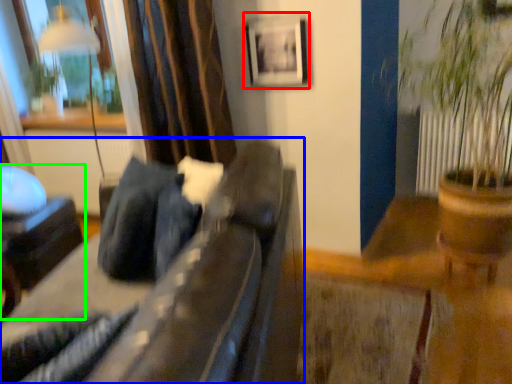
Question: Based on their relative distances, which object is farther from picture frame (highlighted by a red box)? Choose from furniture (highlighted by a blue box) and furniture (highlighted by a green box).

Choices:
 (A) furniture
 (B) furniture

Answer: (B)